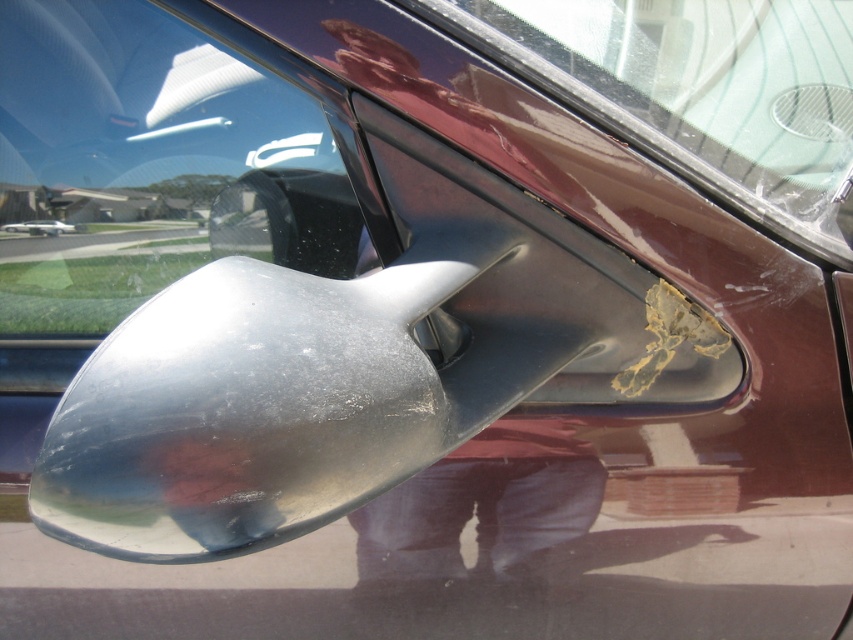
Question: Which point is closer to the camera?

Choices:
 (A) transparent glass car window at upper left
 (B) transparent plastic windshield at upper center

Answer: (B)

Question: Which of the following is the closest to the observer?

Choices:
 (A) transparent plastic windshield at upper center
 (B) transparent glass car window at upper left

Answer: (A)

Question: Is transparent glass car window at upper left positioned in front of transparent plastic windshield at upper center?

Choices:
 (A) yes
 (B) no

Answer: (B)

Question: Can you confirm if transparent glass car window at upper left is thinner than transparent plastic windshield at upper center?

Choices:
 (A) no
 (B) yes

Answer: (B)

Question: Is transparent glass car window at upper left further to camera compared to transparent plastic windshield at upper center?

Choices:
 (A) yes
 (B) no

Answer: (A)

Question: Which of the following is the closest to the observer?

Choices:
 (A) (44, 6)
 (B) (838, 8)

Answer: (A)